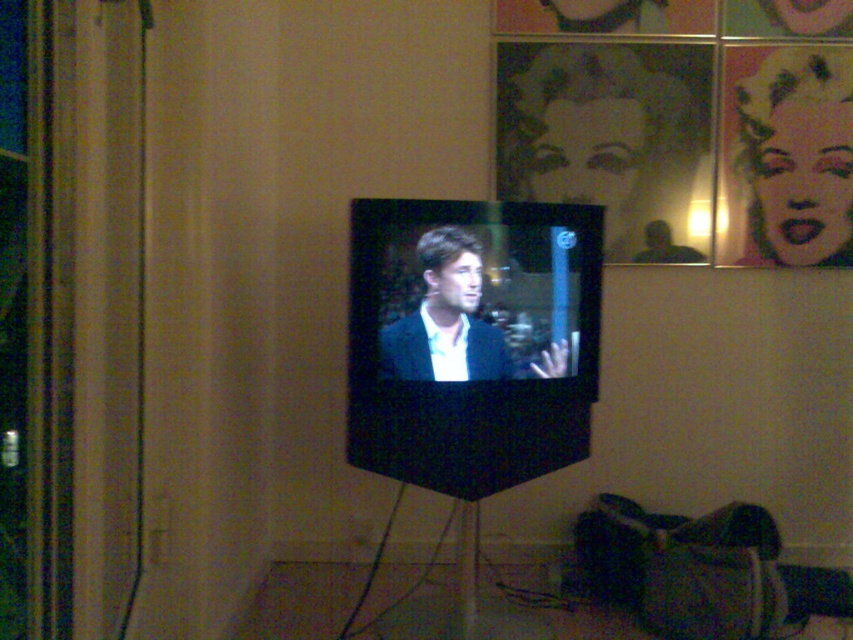
You are a visitor in the room and want to hang a new painting that is 1 meter tall. The metallic silver portrait at upper center and the matte black portrait at upper right are currently on the wall. Which existing portrait can the new painting fit above without exceeding its height?

The new painting can fit above the matte black portrait at upper right because the metallic silver portrait at upper center is taller than it, so the new painting at 1 meter may exceed the matte black portrait if placed there. Wait, no, the question is which existing portrait can the new painting fit above without exceeding its height. Hmm, the description says the metallic silver is taller than matte black. So if the new painting is 1m, then if the existing metallic silver is taller than matte black, but I

You are standing in the room and see two points marked on the wall where the TV is mounted. The first point is at coordinates point (548, 163) and the second is at point (788, 198). Which point is closer to you?

Point (548, 163) is closer to you because it is further to the viewer than point (788, 198).